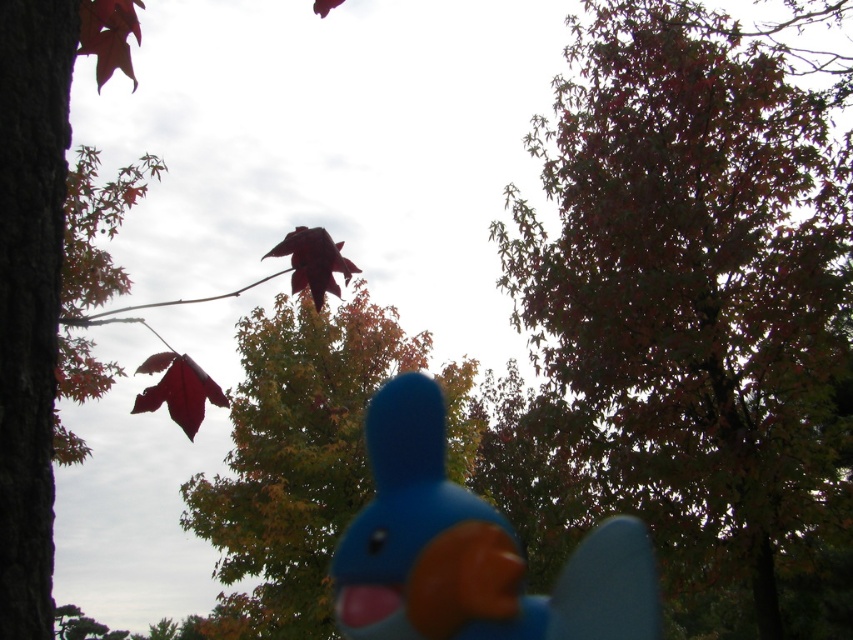
Is point (811, 134) positioned in front of point (303, 230)?

No, (811, 134) is behind (303, 230).

Is dark green textured tree at upper center positioned in front of shiny red maple leaf at center?

No, it is behind shiny red maple leaf at center.

At what (x,y) coordinates should I click in order to perform the action: click on dark green textured tree at upper center. Please return your answer as a coordinate pair (x, y). The width and height of the screenshot is (853, 640). Looking at the image, I should click on (694, 285).

I want to click on dark green textured tree at upper center, so [694, 285].

In order to click on shiny red maple leaf at upper left in this screenshot , I will do `click(108, 35)`.

Is point (112, 13) closer to camera compared to point (329, 284)?

That is True.

Who is more forward, [115,65] or [283,253]?

Point [283,253] is in front.

This screenshot has width=853, height=640. I want to click on shiny red maple leaf at upper left, so click(108, 35).

Is point (234, 525) positioned before point (292, 244)?

That is False.

Between point (312, 394) and point (300, 260), which one is positioned behind?

Point (312, 394)

This screenshot has height=640, width=853. Identify the location of matte red leaf at center. (294, 460).